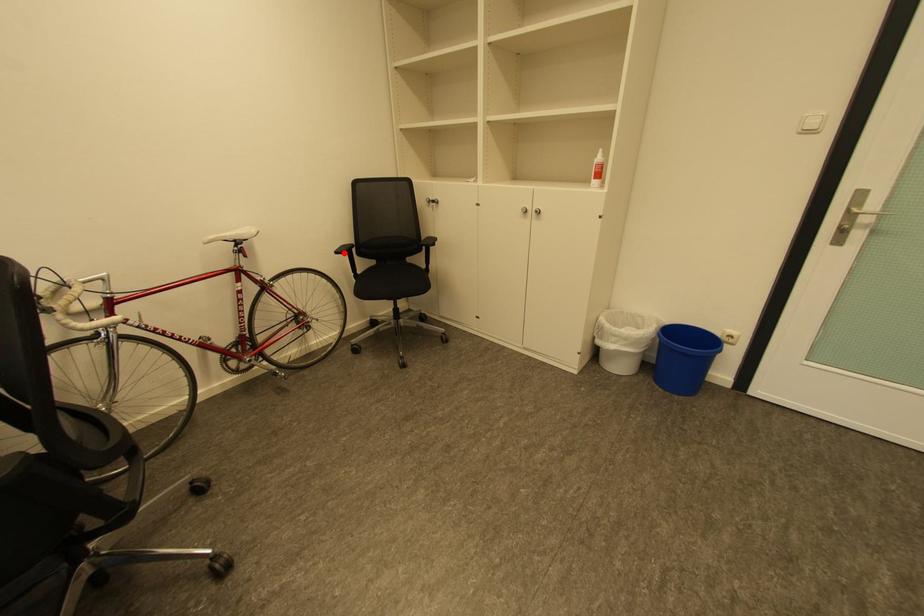
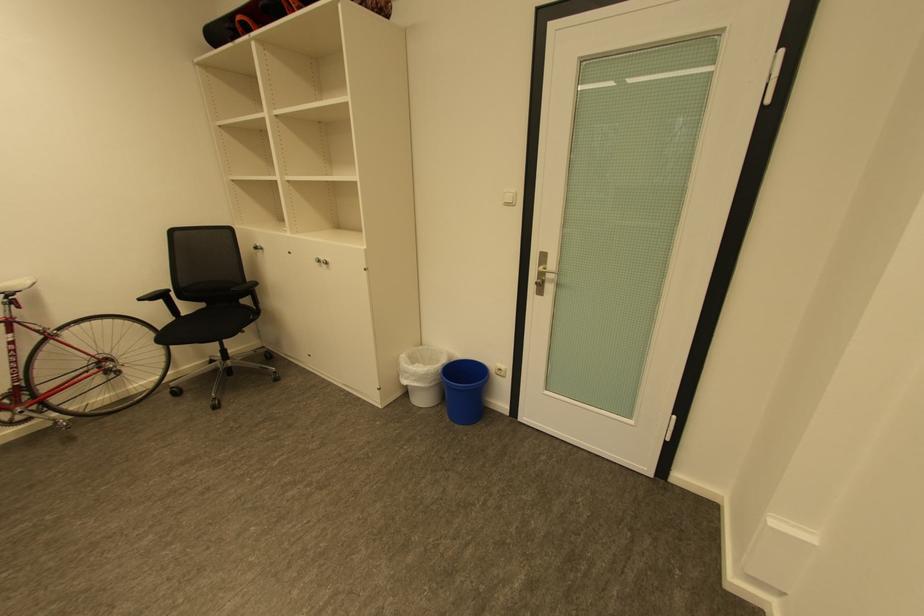
Where in the second image is the point corresponding to the highlighted location from the first image?

(148, 300)